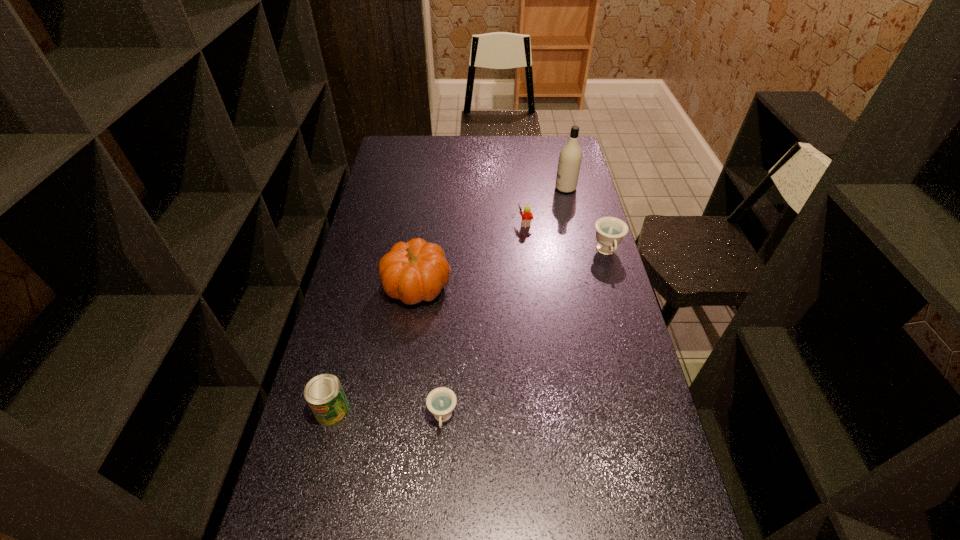
In the image, there is a desktop. Identify the location of vacant space at the far right corner. This screenshot has width=960, height=540. (542, 142).

Locate an element on the screen. This screenshot has width=960, height=540. free space between the Lego and the farther teacup is located at coordinates (565, 237).

The image size is (960, 540). I want to click on free space between the second tallest object and the Lego, so click(470, 254).

Where is `vacant area between the can and the Lego`? Image resolution: width=960 pixels, height=540 pixels. vacant area between the can and the Lego is located at coordinates (429, 316).

The height and width of the screenshot is (540, 960). What are the coordinates of `free space between the farthest object and the right teacup` in the screenshot? It's located at (587, 220).

Image resolution: width=960 pixels, height=540 pixels. In order to click on vacant area between the shortest object and the right teacup in this screenshot , I will do `click(525, 335)`.

Where is `empty space between the pumpkin and the nearer teacup`? Image resolution: width=960 pixels, height=540 pixels. empty space between the pumpkin and the nearer teacup is located at coordinates (430, 352).

This screenshot has height=540, width=960. Find the location of `empty space between the shorter teacup and the shampoo`. empty space between the shorter teacup and the shampoo is located at coordinates (504, 303).

I want to click on vacant region between the fourth object from left to right and the taller teacup, so click(x=565, y=237).

This screenshot has height=540, width=960. Identify the location of vacant space that's between the tallest object and the fifth nearest object. (545, 205).